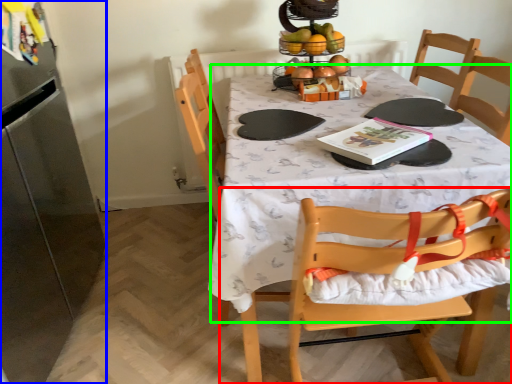
Question: Which is farther away from chair (highlighted by a red box)? appliance (highlighted by a blue box) or tablecloth (highlighted by a green box)?

Choices:
 (A) appliance
 (B) tablecloth

Answer: (A)